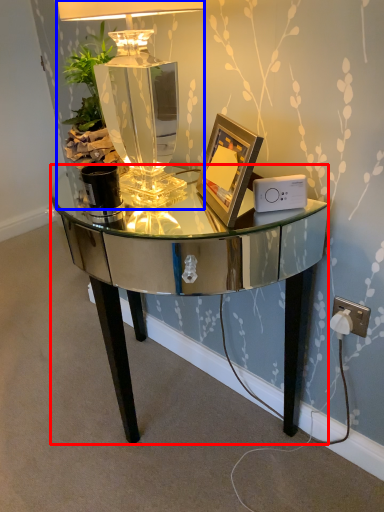
Question: Among these objects, which one is nearest to the camera, desk (highlighted by a red box) or lamp (highlighted by a blue box)?

Choices:
 (A) desk
 (B) lamp

Answer: (A)